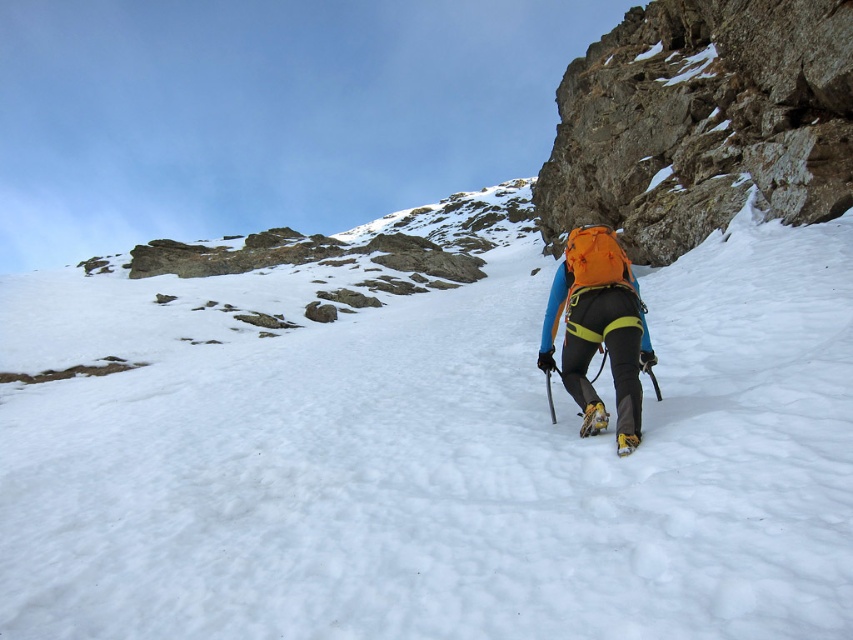
Who is more distant from viewer, (341,372) or (624,449)?

Positioned behind is point (341,372).

Does point (543, 602) come in front of point (587, 404)?

Yes, point (543, 602) is in front of point (587, 404).

What do you see at coordinates (428, 452) in the screenshot? Image resolution: width=853 pixels, height=640 pixels. I see `white fluffy snow at center` at bounding box center [428, 452].

Where is `white fluffy snow at center`? The height and width of the screenshot is (640, 853). white fluffy snow at center is located at coordinates (428, 452).

Is orange fabric backpack at center bigger than yellow rubber ski at lower center?

Yes, orange fabric backpack at center is bigger than yellow rubber ski at lower center.

Identify the location of orange fabric backpack at center. (598, 330).

Between white fluffy snow at center and orange fabric backpack at center, which one appears on the right side from the viewer's perspective?

orange fabric backpack at center

Can you confirm if white fluffy snow at center is thinner than orange fabric backpack at center?

No.

Find the location of a particular element. The height and width of the screenshot is (640, 853). white fluffy snow at center is located at coordinates (428, 452).